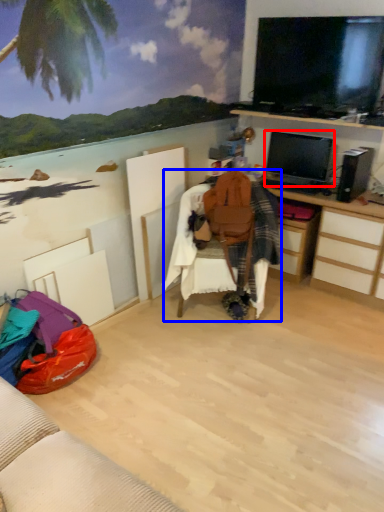
Question: Which of the following is the farthest to the observer, television (highlighted by a red box) or bean bag chair (highlighted by a blue box)?

Choices:
 (A) television
 (B) bean bag chair

Answer: (A)